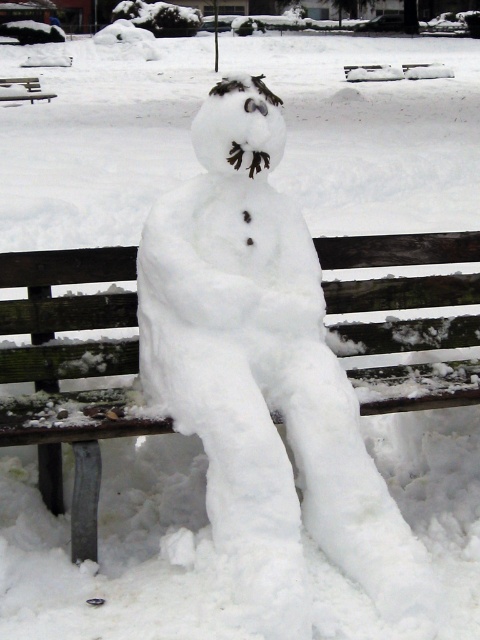
Who is taller, white fluffy snowman at center or brown wooden bench at upper left?

Standing taller between the two is white fluffy snowman at center.

Locate an element on the screen. The image size is (480, 640). white fluffy snowman at center is located at coordinates (264, 372).

From the picture: Is white fluffy snowman at center bigger than wooden bench at center?

Yes.

Can you confirm if white fluffy snowman at center is positioned below wooden bench at center?

No, white fluffy snowman at center is not below wooden bench at center.

What do you see at coordinates (264, 372) in the screenshot?
I see `white fluffy snowman at center` at bounding box center [264, 372].

Identify the location of white fluffy snowman at center. This screenshot has width=480, height=640. (264, 372).

Is wooden bench at center taller than brown wooden bench at upper left?

Indeed, wooden bench at center has a greater height compared to brown wooden bench at upper left.

Does wooden bench at center lie behind brown wooden bench at upper left?

That is False.

Locate an element on the screen. wooden bench at center is located at coordinates (69, 371).